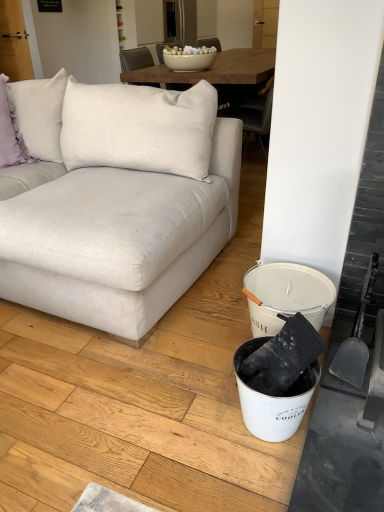
Question: Does white fabric couch at left have a greater width compared to lavender fabric pillow at upper left?

Choices:
 (A) no
 (B) yes

Answer: (B)

Question: Is white fabric couch at left looking in the opposite direction of lavender fabric pillow at upper left?

Choices:
 (A) yes
 (B) no

Answer: (B)

Question: Does white fabric couch at left have a lesser height compared to lavender fabric pillow at upper left?

Choices:
 (A) no
 (B) yes

Answer: (A)

Question: Is white fabric couch at left at the left side of lavender fabric pillow at upper left?

Choices:
 (A) no
 (B) yes

Answer: (A)

Question: Is white fabric couch at left positioned in front of lavender fabric pillow at upper left?

Choices:
 (A) no
 (B) yes

Answer: (B)

Question: From the image's perspective, is gray plastic shovel at right positioned above or below white fabric couch at left?

Choices:
 (A) above
 (B) below

Answer: (B)

Question: Is gray plastic shovel at right bigger or smaller than white fabric couch at left?

Choices:
 (A) small
 (B) big

Answer: (A)

Question: Visually, is gray plastic shovel at right positioned to the left or to the right of white fabric couch at left?

Choices:
 (A) right
 (B) left

Answer: (A)

Question: In terms of height, does gray plastic shovel at right look taller or shorter compared to white fabric couch at left?

Choices:
 (A) short
 (B) tall

Answer: (A)

Question: From a real-world perspective, is white fabric couch at left above or below lavender fabric pillow at upper left?

Choices:
 (A) below
 (B) above

Answer: (A)

Question: From the image's perspective, is white fabric couch at left located above or below lavender fabric pillow at upper left?

Choices:
 (A) above
 (B) below

Answer: (B)

Question: In terms of size, does white fabric couch at left appear bigger or smaller than lavender fabric pillow at upper left?

Choices:
 (A) big
 (B) small

Answer: (A)

Question: Is white fabric couch at left wider or thinner than lavender fabric pillow at upper left?

Choices:
 (A) thin
 (B) wide

Answer: (B)

Question: Is white fabric couch at left taller or shorter than white matte bucket at lower right?

Choices:
 (A) tall
 (B) short

Answer: (A)

Question: Is white fabric couch at left in front of or behind white matte bucket at lower right in the image?

Choices:
 (A) front
 (B) behind

Answer: (A)